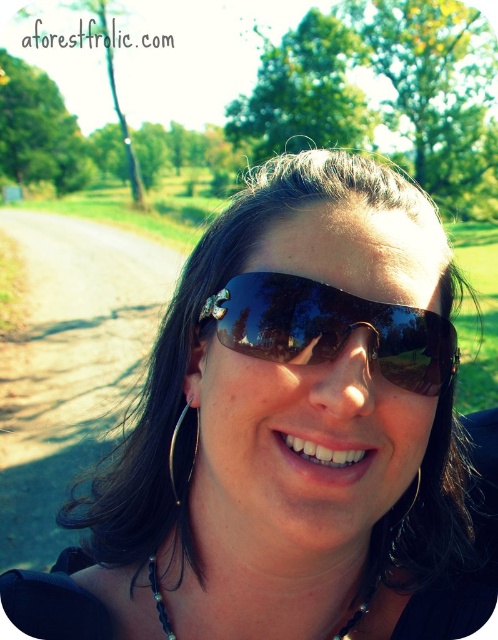
Question: Which point is farther to the camera?

Choices:
 (A) shiny black goggles at center
 (B) black beaded necklace at center

Answer: (B)

Question: Where is shiny black goggles at center located in relation to black beaded necklace at center in the image?

Choices:
 (A) above
 (B) below

Answer: (A)

Question: Which point appears farthest from the camera in this image?

Choices:
 (A) (213, 305)
 (B) (161, 604)

Answer: (B)

Question: Is shiny black goggles at center smaller than black beaded necklace at center?

Choices:
 (A) no
 (B) yes

Answer: (A)

Question: Is shiny black goggles at center to the right of black beaded necklace at center from the viewer's perspective?

Choices:
 (A) yes
 (B) no

Answer: (A)